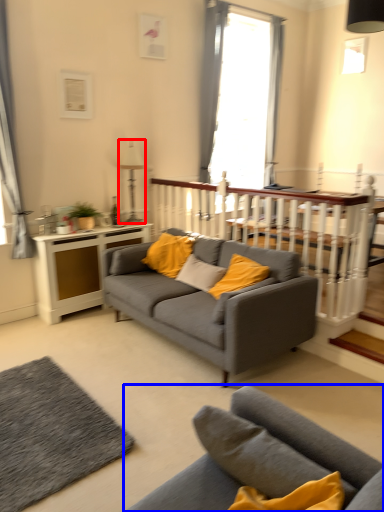
Question: Which point is further to the camera, lamp (highlighted by a red box) or studio couch (highlighted by a blue box)?

Choices:
 (A) lamp
 (B) studio couch

Answer: (A)